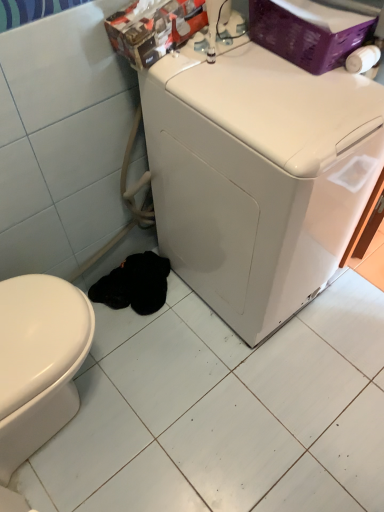
Question: From the image's perspective, relative to white glossy ceramic tile at lower center, is white glossy washing machine at center above or below?

Choices:
 (A) above
 (B) below

Answer: (A)

Question: Looking at the image, does white glossy washing machine at center seem bigger or smaller compared to white glossy ceramic tile at lower center?

Choices:
 (A) small
 (B) big

Answer: (B)

Question: From a real-world perspective, is white glossy washing machine at center physically located above or below white glossy ceramic tile at lower center?

Choices:
 (A) below
 (B) above

Answer: (B)

Question: From a real-world perspective, relative to white glossy washing machine at center, is white glossy ceramic tile at lower center vertically above or below?

Choices:
 (A) below
 (B) above

Answer: (A)

Question: Would you say white glossy ceramic tile at lower center is inside or outside white glossy washing machine at center?

Choices:
 (A) outside
 (B) inside

Answer: (A)

Question: Relative to white glossy washing machine at center, is white glossy ceramic tile at lower center in front or behind?

Choices:
 (A) behind
 (B) front

Answer: (A)

Question: Does point click(x=319, y=456) appear closer or farther from the camera than point click(x=188, y=155)?

Choices:
 (A) farther
 (B) closer

Answer: (A)